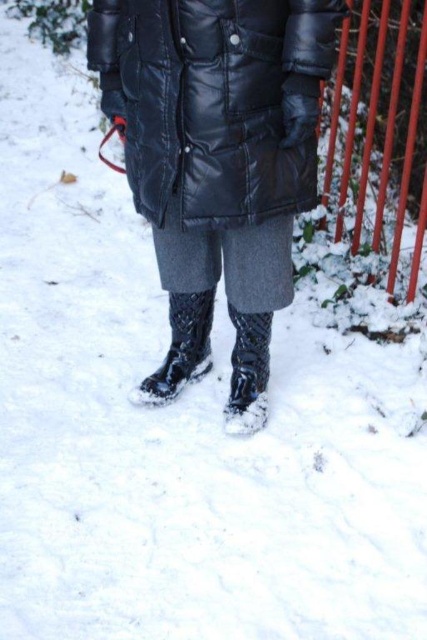
Can you confirm if black leather jacket at center is smaller than glossy rubber boot at center?

No.

Is point (163, 125) less distant than point (181, 301)?

Yes, point (163, 125) is in front of point (181, 301).

Which is behind, point (172, 77) or point (158, 390)?

Positioned behind is point (158, 390).

Where is `black leather jacket at center`? black leather jacket at center is located at coordinates (216, 100).

Can you confirm if black leather jacket at center is bigger than glossy black boot at lower center?

Yes.

Is black leather jacket at center positioned before glossy black boot at lower center?

That is True.

Which is behind, point (178, 192) or point (242, 432)?

The point (242, 432) is more distant.

Identify the location of black leather jacket at center. The image size is (427, 640). (216, 100).

How much distance is there between glossy rubber boot at center and glossy black boot at lower center?

7.73 inches

Is glossy rubber boot at center positioned behind glossy black boot at lower center?

Yes, it is.

You are a GUI agent. You are given a task and a screenshot of the screen. Output one action in this format:
    pyautogui.click(x=<x>, y=<y>)
    Task: Click on the glossy rubber boot at center
    
    Given the screenshot: What is the action you would take?
    pyautogui.click(x=181, y=348)